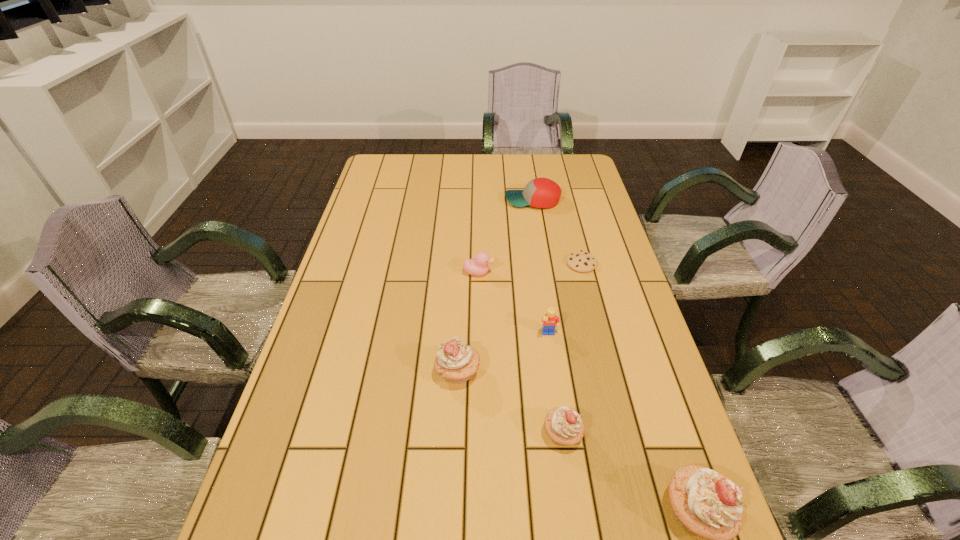
Where is `the third closest cupcake to the duckling`? This screenshot has width=960, height=540. the third closest cupcake to the duckling is located at coordinates (704, 502).

Select which cupcake appears as the closest to the second cupcake from left to right. Please provide its 2D coordinates. Your answer should be formatted as a tuple, i.e. [(x, y)], where the tuple contains the x and y coordinates of a point satisfying the conditions above.

[(704, 502)]

The width and height of the screenshot is (960, 540). Identify the location of free space that satisfies the following two spatial constraints: 1. at the brim of the baseball cap; 2. on the left side of the shortest object. (542, 264).

Where is `blank space that satisfies the following two spatial constraints: 1. on the front-facing side of the second cupcake from left to right; 2. on the left side of the duckling`? This screenshot has width=960, height=540. blank space that satisfies the following two spatial constraints: 1. on the front-facing side of the second cupcake from left to right; 2. on the left side of the duckling is located at coordinates point(478,434).